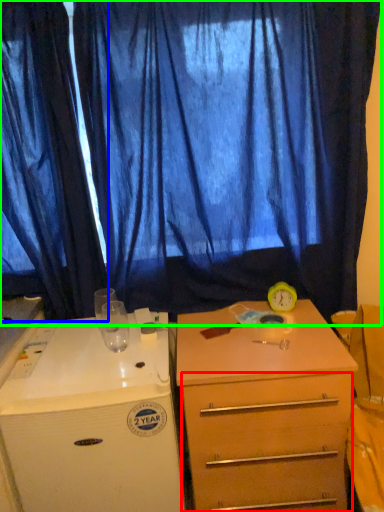
Question: Which object is the closest to the drawer (highlighted by a red box)? Choose among these: curtain (highlighted by a blue box) or curtain (highlighted by a green box).

Choices:
 (A) curtain
 (B) curtain

Answer: (B)